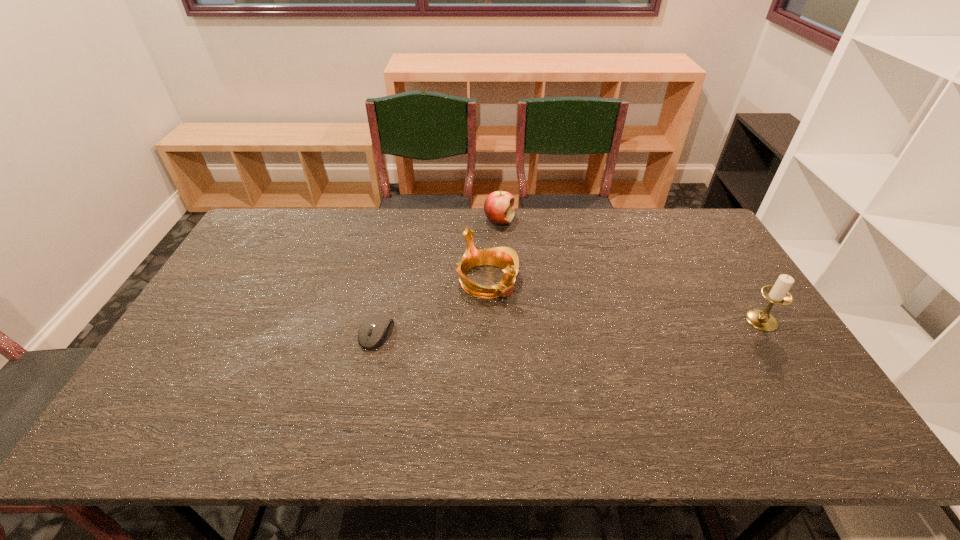
Find the location of a particular element. vacant region at the near right corner of the desktop is located at coordinates (815, 399).

This screenshot has height=540, width=960. Identify the location of empty space between the computer equipment and the tiara. (432, 307).

The image size is (960, 540). Find the location of `vacant space that's between the third nearest object and the tallest object`. vacant space that's between the third nearest object and the tallest object is located at coordinates (624, 301).

Locate an element on the screen. The image size is (960, 540). free space between the tallest object and the shortest object is located at coordinates (569, 327).

In order to click on blank region between the tiara and the rightmost object in this screenshot , I will do `click(624, 301)`.

Where is `free space between the leftmost object and the third nearest object`? Image resolution: width=960 pixels, height=540 pixels. free space between the leftmost object and the third nearest object is located at coordinates (432, 307).

Locate an element on the screen. The width and height of the screenshot is (960, 540). vacant region between the candle holder and the farthest object is located at coordinates (631, 271).

You are a GUI agent. You are given a task and a screenshot of the screen. Output one action in this format:
    pyautogui.click(x=<x>, y=<y>)
    Task: Click on the unoccupied position between the second farthest object and the leftmost object
    
    Given the screenshot: What is the action you would take?
    pyautogui.click(x=432, y=307)

Find the location of `free space between the second farthest object and the tallest object`. free space between the second farthest object and the tallest object is located at coordinates (624, 301).

I want to click on free spot between the computer equipment and the candle holder, so click(569, 327).